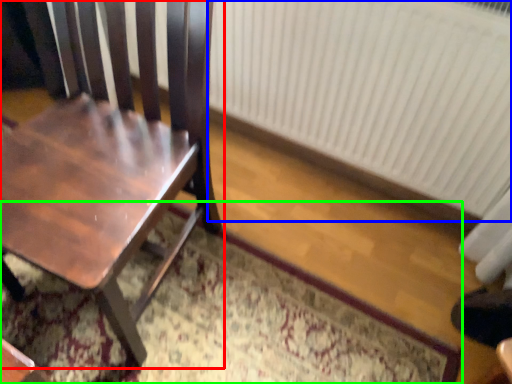
Question: Which object is the closest to the chair (highlighted by a red box)? Choose among these: radiator (highlighted by a blue box) or doormat (highlighted by a green box).

Choices:
 (A) radiator
 (B) doormat

Answer: (B)